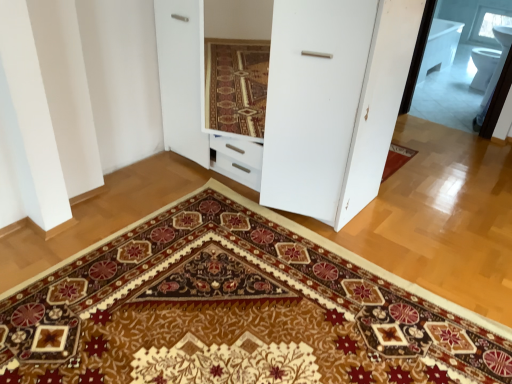
Question: Is transparent glass window at upper right in front of or behind white glossy dresser at center in the image?

Choices:
 (A) front
 (B) behind

Answer: (B)

Question: Which is correct: transparent glass window at upper right is inside white glossy dresser at center, or outside of it?

Choices:
 (A) outside
 (B) inside

Answer: (A)

Question: Estimate the real-world distances between objects in this image. Which object is farther from the transparent glass window at upper right?

Choices:
 (A) white glossy dresser at center
 (B) carpeted mat at center

Answer: (B)

Question: Estimate the real-world distances between objects in this image. Which object is closer to the white glossy dresser at center?

Choices:
 (A) transparent glass window at upper right
 (B) carpeted mat at center

Answer: (B)